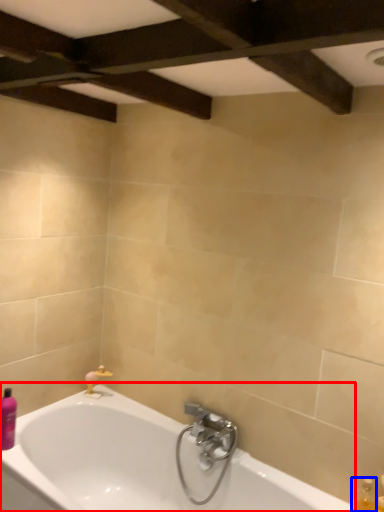
Question: Among these objects, which one is nearest to the camera, bathtub (highlighted by a red box) or bottle (highlighted by a blue box)?

Choices:
 (A) bathtub
 (B) bottle

Answer: (A)